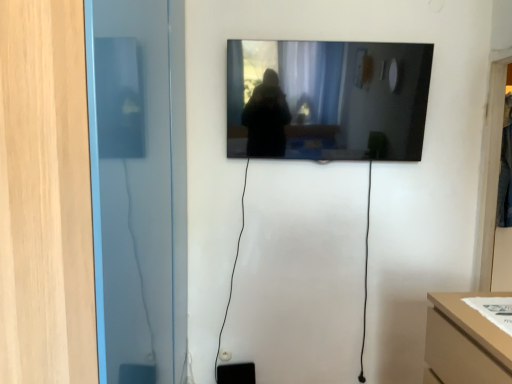
The image size is (512, 384). What do you see at coordinates (329, 100) in the screenshot?
I see `black glossy mirror at upper center` at bounding box center [329, 100].

Find the location of a particular element. transparent glass door at left, which is counted as the second glass door, starting from the back is located at coordinates (138, 187).

Image resolution: width=512 pixels, height=384 pixels. Identify the location of black glossy mirror at upper center. (329, 100).

Is transparent glass door at left, which is the first glass door in left-to-right order, positioned beyond the bounds of black glossy mirror at upper center?

transparent glass door at left, which is the first glass door in left-to-right order, lies outside black glossy mirror at upper center's area.

Looking at this image, is transparent glass door at left, which is the first glass door in left-to-right order, smaller than black glossy mirror at upper center?

No.

From a real-world perspective, is transparent glass door at left, arranged as the second glass door when viewed from the right, located beneath black glossy mirror at upper center?

Yes, from a real-world perspective, transparent glass door at left, arranged as the second glass door when viewed from the right, is below black glossy mirror at upper center.

Is black glossy mirror at upper center completely or partially outside of transparent glass door at right, marked as the 1th glass door in a right-to-left arrangement?

Yes, black glossy mirror at upper center is not within transparent glass door at right, marked as the 1th glass door in a right-to-left arrangement.

Considering their positions, is black glossy mirror at upper center located in front of or behind transparent glass door at right, marked as the 1th glass door in a right-to-left arrangement?

Clearly, black glossy mirror at upper center is in front of transparent glass door at right, marked as the 1th glass door in a right-to-left arrangement.

From a real-world perspective, relative to transparent glass door at right, marked as the 1th glass door in a right-to-left arrangement, is black glossy mirror at upper center vertically above or below?

black glossy mirror at upper center is above transparent glass door at right, marked as the 1th glass door in a right-to-left arrangement.

Is black glossy mirror at upper center oriented away from transparent glass door at right, the 2th glass door viewed from the left?

No.

Which of these two, black glossy mirror at upper center or transparent glass door at left, which is counted as the second glass door, starting from the back, stands shorter?

black glossy mirror at upper center.

Are black glossy mirror at upper center and transparent glass door at left, which is counted as the second glass door, starting from the back, located far from each other?

black glossy mirror at upper center is actually quite close to transparent glass door at left, which is counted as the second glass door, starting from the back.

In the image, there is a transparent glass door at left, arranged as the second glass door when viewed from the right. Identify the location of mirror above it (from the image's perspective). The height and width of the screenshot is (384, 512). (329, 100).

Between transparent glass door at left, positioned as the 1th glass door in front-to-back order, and transparent glass door at right, acting as the first glass door starting from the back, which one is positioned behind?

transparent glass door at right, acting as the first glass door starting from the back, is further from the camera.

Which is correct: transparent glass door at left, which is the first glass door in left-to-right order, is inside transparent glass door at right, the 2th glass door viewed from the left, or outside of it?

transparent glass door at left, which is the first glass door in left-to-right order, is not inside transparent glass door at right, the 2th glass door viewed from the left, it's outside.

What are the coordinates of `glass door located on the right of transparent glass door at left, which is counted as the second glass door, starting from the back` in the screenshot? It's located at (490, 173).

Does point (101, 32) come farther from viewer compared to point (486, 284)?

No, (101, 32) is closer to viewer.

Is transparent glass door at right, the 2th glass door viewed from the left, looking in the opposite direction of black glossy mirror at upper center?

transparent glass door at right, the 2th glass door viewed from the left, is not turned away from black glossy mirror at upper center.

From their relative heights in the image, would you say transparent glass door at right, acting as the first glass door starting from the back, is taller or shorter than black glossy mirror at upper center?

In the image, transparent glass door at right, acting as the first glass door starting from the back, appears to be taller than black glossy mirror at upper center.

This screenshot has height=384, width=512. What are the coordinates of `the 1st glass door below the black glossy mirror at upper center (from the image's perspective)` in the screenshot? It's located at (490, 173).

Between transparent glass door at right, acting as the first glass door starting from the back, and black glossy mirror at upper center, which one has larger size?

black glossy mirror at upper center is bigger.

Is transparent glass door at right, acting as the first glass door starting from the back, positioned before transparent glass door at left, which is the first glass door in left-to-right order?

No, transparent glass door at right, acting as the first glass door starting from the back, is further to the viewer.

Based on the photo, is transparent glass door at right, marked as the 1th glass door in a right-to-left arrangement, bigger than transparent glass door at left, which is the first glass door in left-to-right order?

Incorrect, transparent glass door at right, marked as the 1th glass door in a right-to-left arrangement, is not larger than transparent glass door at left, which is the first glass door in left-to-right order.

Considering the sizes of transparent glass door at right, the 2th glass door viewed from the left, and transparent glass door at left, which is the first glass door in left-to-right order, in the image, is transparent glass door at right, the 2th glass door viewed from the left, taller or shorter than transparent glass door at left, which is the first glass door in left-to-right order,?

transparent glass door at right, the 2th glass door viewed from the left, is shorter than transparent glass door at left, which is the first glass door in left-to-right order.

Which object is thinner, transparent glass door at right, which is counted as the second glass door, starting from the front, or transparent glass door at left, arranged as the second glass door when viewed from the right?

Thinner between the two is transparent glass door at right, which is counted as the second glass door, starting from the front.

Locate an element on the screen. The image size is (512, 384). mirror behind the transparent glass door at left, arranged as the second glass door when viewed from the right is located at coordinates [329, 100].

There is a black glossy mirror at upper center. Find the location of `the 1st glass door below it (from the image's perspective)`. the 1st glass door below it (from the image's perspective) is located at coordinates (490, 173).

From the image, which object appears to be farther from transparent glass door at right, the 2th glass door viewed from the left, transparent glass door at left, positioned as the 1th glass door in front-to-back order, or black glossy mirror at upper center?

Among the two, transparent glass door at left, positioned as the 1th glass door in front-to-back order, is located further to transparent glass door at right, the 2th glass door viewed from the left.

From the image, which object appears to be farther from transparent glass door at left, positioned as the 1th glass door in front-to-back order, transparent glass door at right, acting as the first glass door starting from the back, or black glossy mirror at upper center?

The object further to transparent glass door at left, positioned as the 1th glass door in front-to-back order, is transparent glass door at right, acting as the first glass door starting from the back.

From the image, which object appears to be farther from transparent glass door at right, marked as the 1th glass door in a right-to-left arrangement, black glossy mirror at upper center or transparent glass door at left, which is the first glass door in left-to-right order?

transparent glass door at left, which is the first glass door in left-to-right order, is further to transparent glass door at right, marked as the 1th glass door in a right-to-left arrangement.

When comparing their distances from black glossy mirror at upper center, does transparent glass door at right, marked as the 1th glass door in a right-to-left arrangement, or transparent glass door at left, arranged as the second glass door when viewed from the right, seem closer?

Among the two, transparent glass door at right, marked as the 1th glass door in a right-to-left arrangement, is located nearer to black glossy mirror at upper center.

When comparing their distances from black glossy mirror at upper center, does transparent glass door at left, which is counted as the second glass door, starting from the back, or transparent glass door at right, which is counted as the second glass door, starting from the front, seem further?

transparent glass door at left, which is counted as the second glass door, starting from the back.

From the image, which object appears to be farther from transparent glass door at left, arranged as the second glass door when viewed from the right, black glossy mirror at upper center or transparent glass door at right, acting as the first glass door starting from the back?

transparent glass door at right, acting as the first glass door starting from the back.

Locate an element on the screen. This screenshot has height=384, width=512. mirror between transparent glass door at left, arranged as the second glass door when viewed from the right, and transparent glass door at right, the 2th glass door viewed from the left, in the horizontal direction is located at coordinates (329, 100).